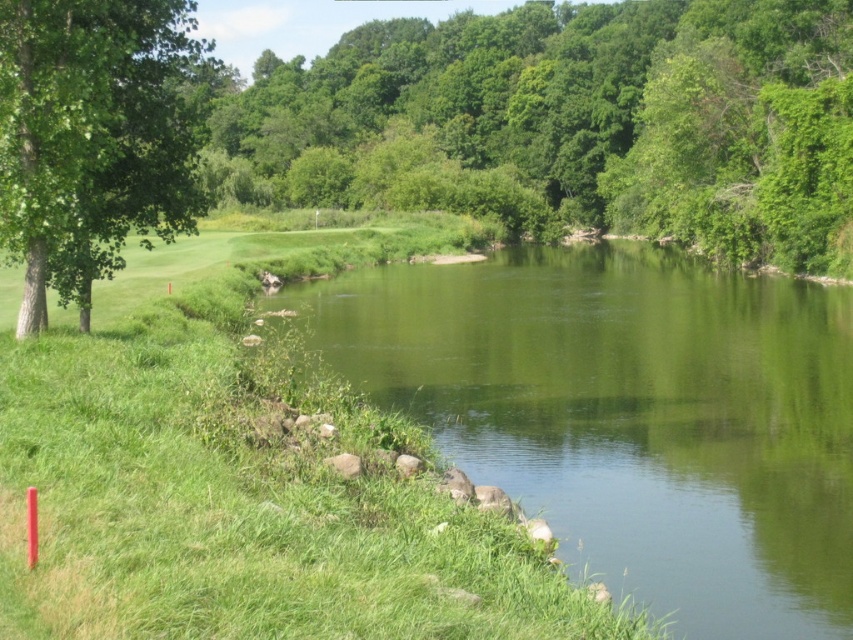
You are an environmental researcher observing the landscape. You need to identify which tree is larger between the green leafy tree at upper center and the green leafy tree at left. Based on the scene, which one is larger?

Result: The green leafy tree at upper center is bigger than the green leafy tree at left.

You are a golfer standing on the green grassy golf course at lower left and want to hit a ball to the green leafy tree at left. Considering the distance between them, can you estimate how many average golf swings it would take to reach the tree?

The green grassy golf course at lower left is 14.13 meters away from the green leafy tree at left. An average golf swing covers about 200 meters, so it would take just one swing to reach the tree.

You are a golfer standing on the green grassy golf course at lower left and want to hit the ball to the green smooth water at center. Which direction should you aim your shot?

The green grassy golf course at lower left is located above the green smooth water at center, so you should aim downward towards the green smooth water at center.